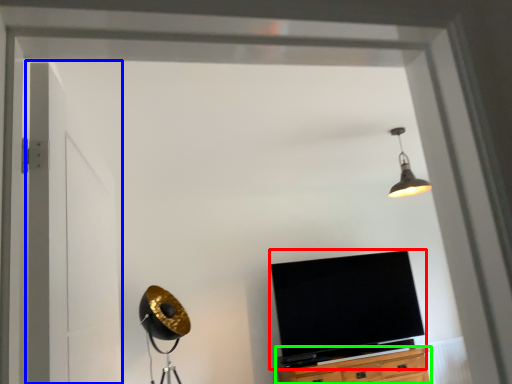
Question: Which is nearer to the television (highlighted by a red box)? door (highlighted by a blue box) or cabinetry (highlighted by a green box).

Choices:
 (A) door
 (B) cabinetry

Answer: (B)